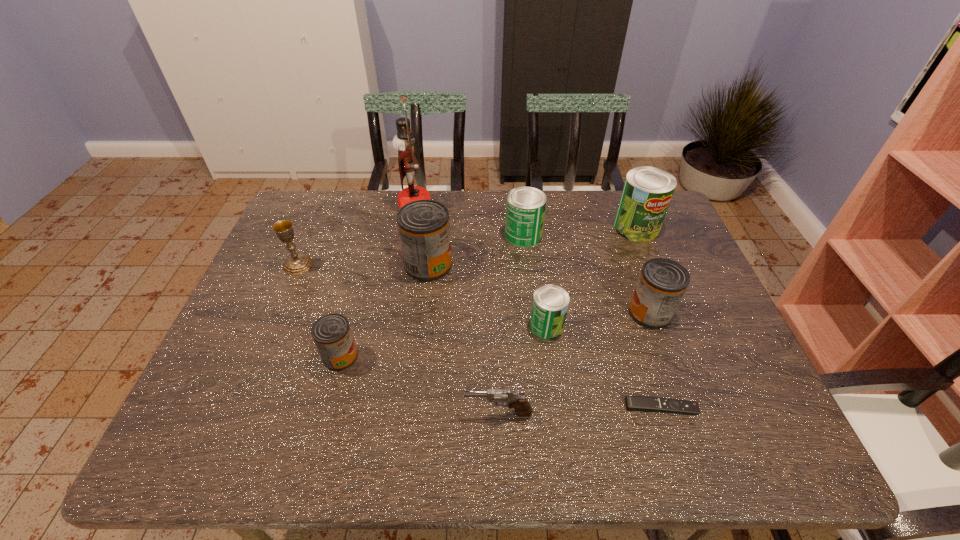
Identify the location of remote control at the right edge. (633, 403).

The height and width of the screenshot is (540, 960). What are the coordinates of `object that is positioned at the far right corner` in the screenshot? It's located at (647, 192).

This screenshot has width=960, height=540. Find the location of `vacant space at the far edge of the desktop`. vacant space at the far edge of the desktop is located at coordinates (502, 230).

This screenshot has height=540, width=960. In the image, there is a desktop. Identify the location of vacant space at the near edge. (654, 450).

I want to click on vacant space at the left edge, so pyautogui.click(x=283, y=281).

Where is `vacant region at the right edge of the desktop`? vacant region at the right edge of the desktop is located at coordinates (709, 328).

This screenshot has width=960, height=540. In the image, there is a desktop. What are the coordinates of `free space at the far left corner` in the screenshot? It's located at (319, 219).

The image size is (960, 540). Find the location of `blank region between the second biggest green can and the red nutcracker`. blank region between the second biggest green can and the red nutcracker is located at coordinates (469, 221).

Image resolution: width=960 pixels, height=540 pixels. In order to click on vacant area that lies between the second can from left to right and the second shortest object in this screenshot , I will do `click(464, 339)`.

Identify the location of vacant area that lies between the rightmost red can and the gray pistol. This screenshot has height=540, width=960. (574, 363).